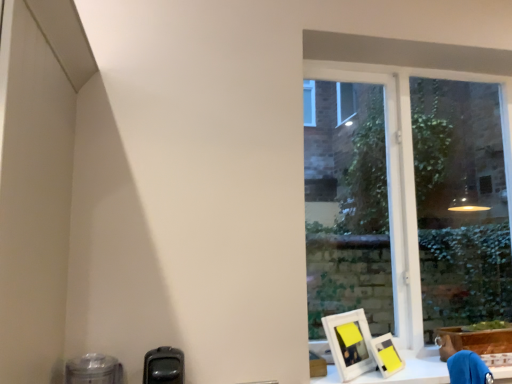
Describe the element at coordinates (409, 172) in the screenshot. I see `transparent glass window at right` at that location.

This screenshot has width=512, height=384. What are the coordinates of `blue fabric swivel chair at lower right` in the screenshot? It's located at (468, 369).

Describe the element at coordinates (386, 355) in the screenshot. This screenshot has width=512, height=384. I see `matte yellow picture frame at lower right, which is the 2th picture frame in left-to-right order` at that location.

Image resolution: width=512 pixels, height=384 pixels. What do you see at coordinates (412, 370) in the screenshot? I see `white matte workbench at lower right` at bounding box center [412, 370].

Find the location of `transparent glass window at right`. transparent glass window at right is located at coordinates (409, 172).

How different are the orientations of matte yellow picture frame at lower right, which is the 2th picture frame in left-to-right order, and transparent glass window at right in degrees?

matte yellow picture frame at lower right, which is the 2th picture frame in left-to-right order, and transparent glass window at right are facing 38 degrees away from each other.

In the scene shown: Is matte yellow picture frame at lower right, the 1th picture frame viewed from the right, taller or shorter than transparent glass window at right?

Clearly, matte yellow picture frame at lower right, the 1th picture frame viewed from the right, is shorter compared to transparent glass window at right.

Between matte yellow picture frame at lower right, the 1th picture frame viewed from the right, and transparent glass window at right, which one has larger size?

transparent glass window at right.

Is matte yellow picture frame at lower right, the 1th picture frame viewed from the right, oriented towards transparent glass window at right?

No, matte yellow picture frame at lower right, the 1th picture frame viewed from the right, is not aimed at transparent glass window at right.

From the image's perspective, would you say brown cardboard box at lower right is positioned over matte yellow picture frame at lower right, the 1th picture frame viewed from the right?

No.

Which object is further away from the camera, brown cardboard box at lower right or matte yellow picture frame at lower right, which is the 2th picture frame in left-to-right order?

Positioned behind is brown cardboard box at lower right.

Is brown cardboard box at lower right outside of matte yellow picture frame at lower right, which is the 2th picture frame in left-to-right order?

Yes, brown cardboard box at lower right is not within matte yellow picture frame at lower right, which is the 2th picture frame in left-to-right order.

Are brown cardboard box at lower right and matte yellow picture frame at lower right, which is the 2th picture frame in left-to-right order, located far from each other?

No, brown cardboard box at lower right is in close proximity to matte yellow picture frame at lower right, which is the 2th picture frame in left-to-right order.

Does white matte workbench at lower right have a lesser width compared to transparent glass window at right?

In fact, white matte workbench at lower right might be wider than transparent glass window at right.

Which is behind, point (428, 376) or point (471, 75)?

Point (471, 75)

From the image's perspective, is white matte workbench at lower right on top of transparent glass window at right?

No.

Which is correct: white matte workbench at lower right is inside transparent glass window at right, or outside of it?

white matte workbench at lower right is located beyond the bounds of transparent glass window at right.

Does brown cardboard box at lower right turn towards transparent glass window at right?

No, brown cardboard box at lower right does not turn towards transparent glass window at right.

Is transparent glass window at right located within brown cardboard box at lower right?

No, transparent glass window at right is located outside of brown cardboard box at lower right.

Between brown cardboard box at lower right and transparent glass window at right, which one has more height?

Standing taller between the two is transparent glass window at right.

From the picture: Is white matte workbench at lower right positioned beyond the bounds of brown cardboard box at lower right?

Absolutely, white matte workbench at lower right is external to brown cardboard box at lower right.

Is white matte workbench at lower right wider or thinner than brown cardboard box at lower right?

Considering their sizes, white matte workbench at lower right looks broader than brown cardboard box at lower right.

Does white matte workbench at lower right have a larger size compared to brown cardboard box at lower right?

Indeed, white matte workbench at lower right has a larger size compared to brown cardboard box at lower right.

From the image's perspective, would you say white matte workbench at lower right is positioned over brown cardboard box at lower right?

No, from the image's perspective, white matte workbench at lower right is not on top of brown cardboard box at lower right.

Between matte yellow picture frame at lower right, the 1th picture frame viewed from the right, and white matte workbench at lower right, which one has larger size?

white matte workbench at lower right.

Find the location of a particular element. workbench below the matte yellow picture frame at lower right, the 1th picture frame viewed from the right (from a real-world perspective) is located at coordinates (412, 370).

Which point is more forward, (393, 351) or (352, 383)?

The point (352, 383) is closer to the camera.

How many degrees apart are the facing directions of matte yellow picture frame at lower right, the 1th picture frame viewed from the right, and white matte workbench at lower right?

The angular difference between matte yellow picture frame at lower right, the 1th picture frame viewed from the right, and white matte workbench at lower right is 38 degrees.

Does matte yellow picture frame at lower right, the 1th picture frame viewed from the right, turn towards white matte picture frame at lower right, which appears as the 1th picture frame when viewed from the left?

No, matte yellow picture frame at lower right, the 1th picture frame viewed from the right, is not oriented towards white matte picture frame at lower right, which appears as the 1th picture frame when viewed from the left.

Considering the relative sizes of matte yellow picture frame at lower right, which is the 2th picture frame in left-to-right order, and white matte picture frame at lower right, which appears as the 1th picture frame when viewed from the left, in the image provided, is matte yellow picture frame at lower right, which is the 2th picture frame in left-to-right order, taller than white matte picture frame at lower right, which appears as the 1th picture frame when viewed from the left,?

Incorrect, the height of matte yellow picture frame at lower right, which is the 2th picture frame in left-to-right order, is not larger of that of white matte picture frame at lower right, which appears as the 1th picture frame when viewed from the left.

Between matte yellow picture frame at lower right, the 1th picture frame viewed from the right, and white matte picture frame at lower right, which is the second picture frame from right to left, which one has larger size?

With larger size is white matte picture frame at lower right, which is the second picture frame from right to left.

Is matte yellow picture frame at lower right, which is the 2th picture frame in left-to-right order, inside the boundaries of white matte picture frame at lower right, which is the second picture frame from right to left, or outside?

matte yellow picture frame at lower right, which is the 2th picture frame in left-to-right order, is located beyond the bounds of white matte picture frame at lower right, which is the second picture frame from right to left.

This screenshot has height=384, width=512. Find the location of `the 2nd picture frame directly beneath the transparent glass window at right (from a real-world perspective)`. the 2nd picture frame directly beneath the transparent glass window at right (from a real-world perspective) is located at coordinates (386, 355).

The height and width of the screenshot is (384, 512). Identify the location of cardboard box located behind the matte yellow picture frame at lower right, which is the 2th picture frame in left-to-right order. (473, 341).

From the image, which object appears to be farther from white matte picture frame at lower right, which appears as the 1th picture frame when viewed from the left, matte yellow picture frame at lower right, which is the 2th picture frame in left-to-right order, or transparent glass window at right?

Among the two, transparent glass window at right is located further to white matte picture frame at lower right, which appears as the 1th picture frame when viewed from the left.

From the image, which object appears to be farther from transparent glass window at right, matte yellow picture frame at lower right, the 1th picture frame viewed from the right, or blue fabric swivel chair at lower right?

blue fabric swivel chair at lower right.

When comparing their distances from transparent glass window at right, does blue fabric swivel chair at lower right or white matte picture frame at lower right, which is the second picture frame from right to left, seem closer?

white matte picture frame at lower right, which is the second picture frame from right to left, is closer to transparent glass window at right.

Which object lies nearer to the anchor point blue fabric swivel chair at lower right, brown cardboard box at lower right or white matte picture frame at lower right, which is the second picture frame from right to left?

brown cardboard box at lower right is closer to blue fabric swivel chair at lower right.

From the image, which object appears to be nearer to blue fabric swivel chair at lower right, brown cardboard box at lower right or matte yellow picture frame at lower right, the 1th picture frame viewed from the right?

The object closer to blue fabric swivel chair at lower right is matte yellow picture frame at lower right, the 1th picture frame viewed from the right.

Looking at the image, which one is located further to matte yellow picture frame at lower right, which is the 2th picture frame in left-to-right order, white matte workbench at lower right or white matte picture frame at lower right, which is the second picture frame from right to left?

white matte workbench at lower right is further to matte yellow picture frame at lower right, which is the 2th picture frame in left-to-right order.

Considering their positions, is blue fabric swivel chair at lower right positioned closer to white matte picture frame at lower right, which is the second picture frame from right to left, than matte yellow picture frame at lower right, the 1th picture frame viewed from the right?

The object closer to white matte picture frame at lower right, which is the second picture frame from right to left, is matte yellow picture frame at lower right, the 1th picture frame viewed from the right.

From the image, which object appears to be nearer to white matte workbench at lower right, brown cardboard box at lower right or blue fabric swivel chair at lower right?

The object closer to white matte workbench at lower right is brown cardboard box at lower right.

Where is `swivel chair between white matte picture frame at lower right, which is the second picture frame from right to left, and brown cardboard box at lower right from left to right`? The height and width of the screenshot is (384, 512). swivel chair between white matte picture frame at lower right, which is the second picture frame from right to left, and brown cardboard box at lower right from left to right is located at coordinates (468, 369).

Find the location of a particular element. Image resolution: width=512 pixels, height=384 pixels. swivel chair located between matte yellow picture frame at lower right, the 1th picture frame viewed from the right, and brown cardboard box at lower right in the left-right direction is located at coordinates (468, 369).

Where is `workbench located between blue fabric swivel chair at lower right and brown cardboard box at lower right in the depth direction`? This screenshot has width=512, height=384. workbench located between blue fabric swivel chair at lower right and brown cardboard box at lower right in the depth direction is located at coordinates (412, 370).

Where is `cardboard box between transparent glass window at right and white matte workbench at lower right vertically`? This screenshot has width=512, height=384. cardboard box between transparent glass window at right and white matte workbench at lower right vertically is located at coordinates (473, 341).